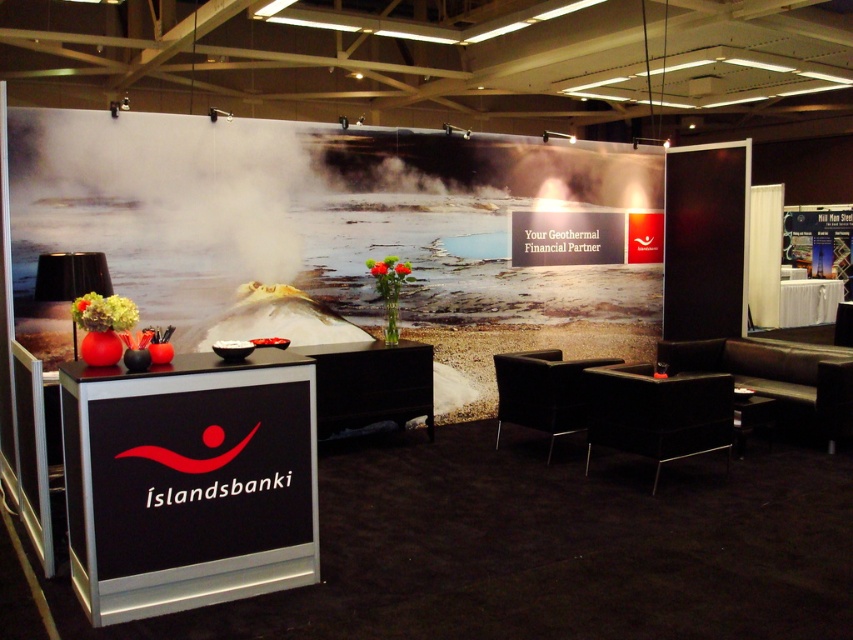
You are a visitor at the exhibition booth and need to place a large promotional brochure on the surface that can accommodate it. Which object between the black metallic table at lower left and the dark brown leather armchair at center would be suitable?

The black metallic table at lower left is bigger than the dark brown leather armchair at center, so the brochure can be placed on the black metallic table at lower left.

You are a visitor at the exhibition booth and want to sit down. Which chair, the black leather armchair at lower right or the dark brown leather armchair at center, is shorter in height?

The black leather armchair at lower right is not as tall as the dark brown leather armchair at center, so the black leather armchair at lower right is shorter in height.

You are an event attendee at the booth and need to place a large promotional brochure. Which table, the black metallic table at lower left or the black glossy table at center, can accommodate it better?

The black metallic table at lower left is bigger than the black glossy table at center, so it can accommodate the large promotional brochure better.